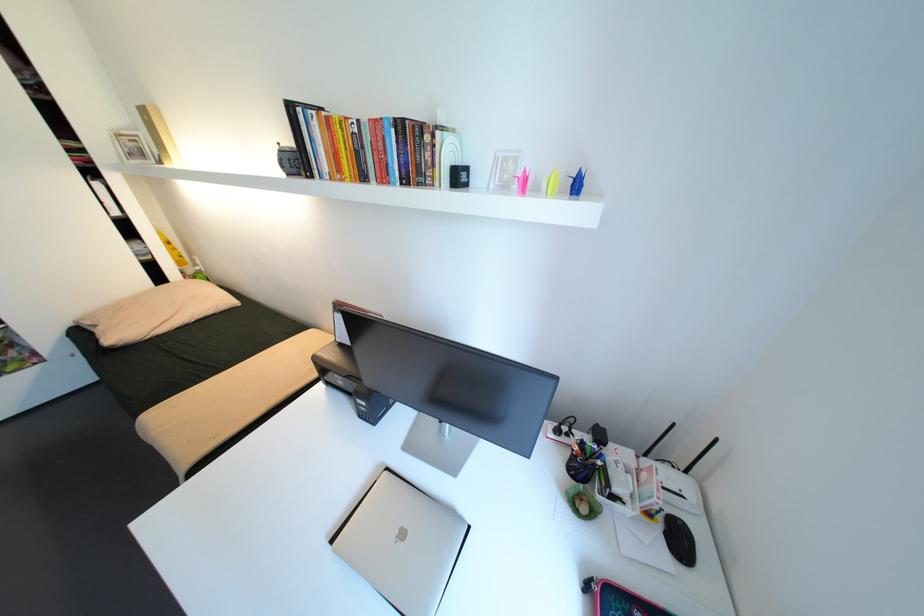
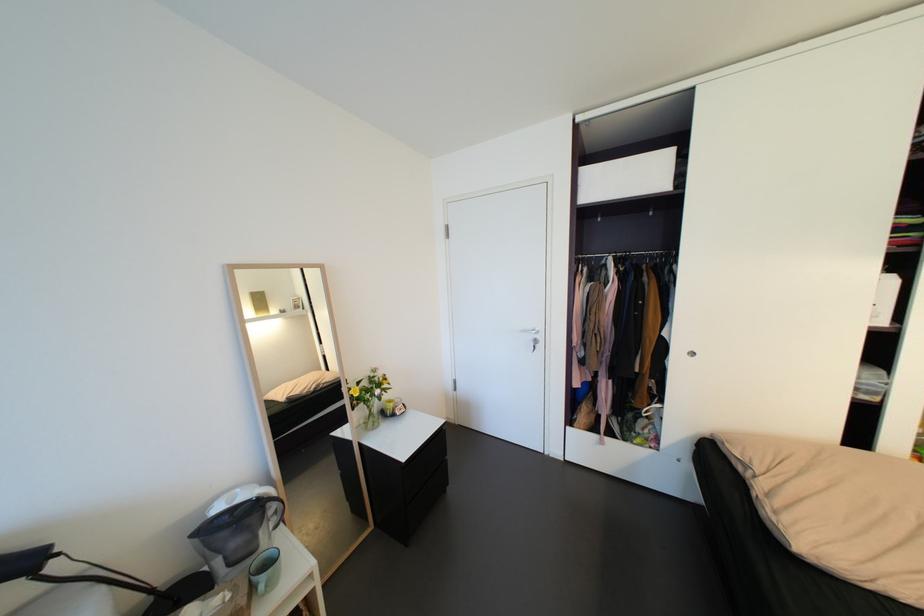
Locate, in the second image, the point that corresponds to point 104,185 in the first image.

(900, 278)